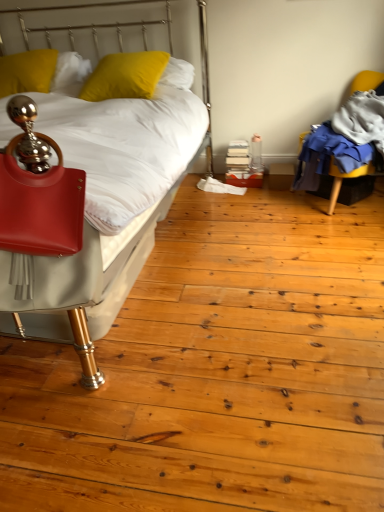
Question: From the image's perspective, does matte white bed at left appear lower than matte red handbag at left?

Choices:
 (A) no
 (B) yes

Answer: (A)

Question: Is matte white bed at left surrounding matte red handbag at left?

Choices:
 (A) no
 (B) yes

Answer: (B)

Question: Is matte white bed at left turned away from matte red handbag at left?

Choices:
 (A) yes
 (B) no

Answer: (B)

Question: From the image's perspective, is matte white bed at left located above matte red handbag at left?

Choices:
 (A) yes
 (B) no

Answer: (A)

Question: From a real-world perspective, is matte white bed at left on matte red handbag at left?

Choices:
 (A) no
 (B) yes

Answer: (A)

Question: Can you confirm if matte white bed at left is positioned to the left of matte red handbag at left?

Choices:
 (A) yes
 (B) no

Answer: (A)

Question: Does yellow matte pillow at upper left, which is the first pillow in left-to-right order, have a smaller size compared to matte white bed at left?

Choices:
 (A) yes
 (B) no

Answer: (A)

Question: Is the position of yellow matte pillow at upper left, arranged as the second pillow when viewed from the right, less distant than that of matte white bed at left?

Choices:
 (A) no
 (B) yes

Answer: (A)

Question: Is matte white bed at left completely or partially inside yellow matte pillow at upper left, arranged as the second pillow when viewed from the right?

Choices:
 (A) no
 (B) yes

Answer: (A)

Question: Considering the relative positions of yellow matte pillow at upper left, arranged as the second pillow when viewed from the right, and matte white bed at left in the image provided, is yellow matte pillow at upper left, arranged as the second pillow when viewed from the right, to the left of matte white bed at left from the viewer's perspective?

Choices:
 (A) no
 (B) yes

Answer: (B)

Question: Is yellow matte pillow at upper left, arranged as the second pillow when viewed from the right, next to matte white bed at left and touching it?

Choices:
 (A) no
 (B) yes

Answer: (A)

Question: From the image's perspective, does yellow matte pillow at upper left, arranged as the second pillow when viewed from the right, appear lower than matte white bed at left?

Choices:
 (A) no
 (B) yes

Answer: (A)

Question: From the image's perspective, would you say matte red handbag at left is positioned over matte white bed at left?

Choices:
 (A) no
 (B) yes

Answer: (A)